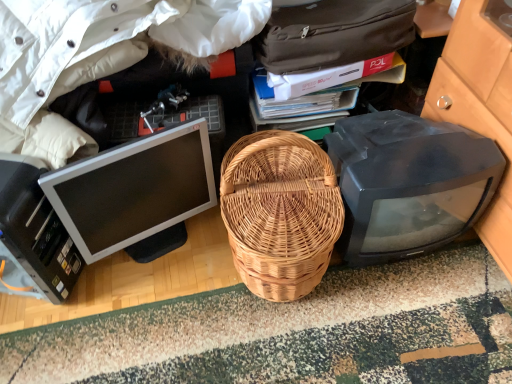
Question: Does white glossy computer monitor at left, arranged as the second computer monitor when viewed from the right, have a greater width compared to black plastic printer at lower left?

Choices:
 (A) yes
 (B) no

Answer: (B)

Question: Is white glossy computer monitor at left, arranged as the second computer monitor when viewed from the right, next to black plastic printer at lower left?

Choices:
 (A) yes
 (B) no

Answer: (B)

Question: Does white glossy computer monitor at left, arranged as the second computer monitor when viewed from the right, lie behind black plastic printer at lower left?

Choices:
 (A) no
 (B) yes

Answer: (B)

Question: Is white glossy computer monitor at left, the 1th computer monitor when ordered from left to right, oriented towards black plastic printer at lower left?

Choices:
 (A) yes
 (B) no

Answer: (B)

Question: Would you say white glossy computer monitor at left, arranged as the second computer monitor when viewed from the right, is outside black plastic printer at lower left?

Choices:
 (A) yes
 (B) no

Answer: (A)

Question: Does white glossy computer monitor at left, arranged as the second computer monitor when viewed from the right, have a lesser width compared to black plastic printer at lower left?

Choices:
 (A) yes
 (B) no

Answer: (A)

Question: Is white cotton jacket at upper left taller than black plastic printer at lower left?

Choices:
 (A) yes
 (B) no

Answer: (A)

Question: Is white cotton jacket at upper left with black plastic printer at lower left?

Choices:
 (A) no
 (B) yes

Answer: (A)

Question: Could you tell me if white cotton jacket at upper left is facing black plastic printer at lower left?

Choices:
 (A) yes
 (B) no

Answer: (A)

Question: Is black plastic printer at lower left located within white cotton jacket at upper left?

Choices:
 (A) yes
 (B) no

Answer: (A)

Question: Is white cotton jacket at upper left not within black plastic printer at lower left?

Choices:
 (A) no
 (B) yes

Answer: (B)

Question: From a real-world perspective, is white cotton jacket at upper left on black plastic printer at lower left?

Choices:
 (A) yes
 (B) no

Answer: (A)

Question: From the image's perspective, is natural wicker picnic basket at center located above white cotton jacket at upper left?

Choices:
 (A) no
 (B) yes

Answer: (A)